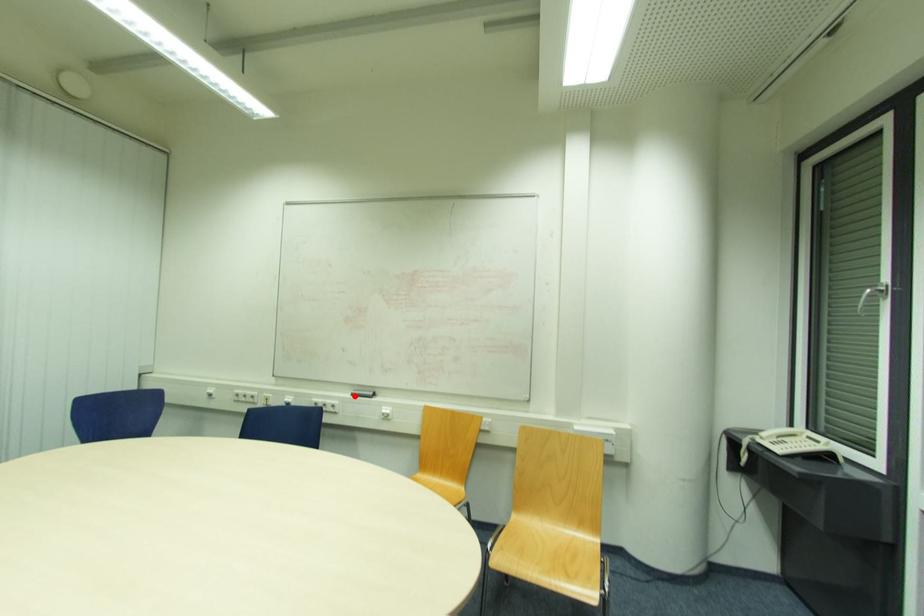
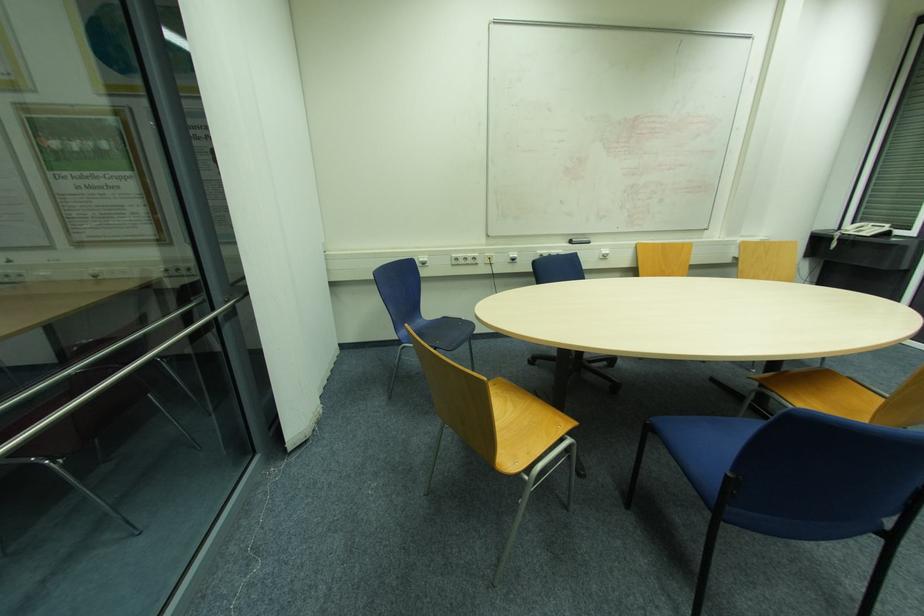
Question: I am providing you with two images of the same scene from different viewpoints. Image1 has a red point marked. In image2, the corresponding 3D location appears at what relative position? Reply with the corresponding letter.

Choices:
 (A) Closer
 (B) Farther

Answer: (A)